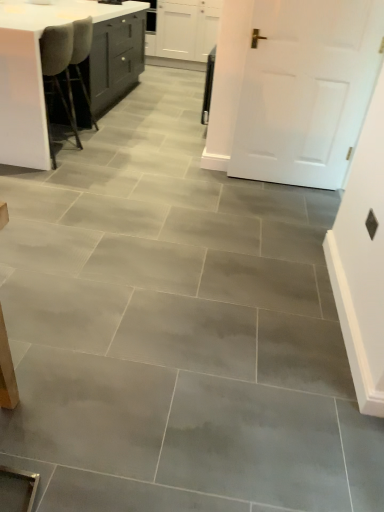
This screenshot has height=512, width=384. Describe the element at coordinates (306, 90) in the screenshot. I see `white matte door at upper right` at that location.

Describe the element at coordinates (184, 29) in the screenshot. I see `white matte cabinet at upper center` at that location.

You are a GUI agent. You are given a task and a screenshot of the screen. Output one action in this format:
    pyautogui.click(x=<x>, y=<y>)
    Task: Click on the white matte door at upper right
    This screenshot has width=384, height=512.
    Given the screenshot: What is the action you would take?
    pyautogui.click(x=306, y=90)

Which of these two, white matte cabinet at upper center or white matte door at upper right, stands taller?

Standing taller between the two is white matte door at upper right.

From the image's perspective, between white matte cabinet at upper center and white matte door at upper right, which one is located above?

white matte cabinet at upper center.

Visually, is white matte cabinet at upper center positioned to the left or to the right of white matte door at upper right?

From the image, it's evident that white matte cabinet at upper center is to the left of white matte door at upper right.

Which object is more forward, white matte cabinet at upper center or white matte door at upper right?

white matte door at upper right.

From the picture: Is white matte cabinet at upper center next to white glossy table at upper left and touching it?

white matte cabinet at upper center and white glossy table at upper left are not in contact.

Is white matte cabinet at upper center completely or partially outside of white glossy table at upper left?

Yes, white matte cabinet at upper center is outside of white glossy table at upper left.

Based on the photo, is the depth of white matte cabinet at upper center greater than that of white glossy table at upper left?

Yes, the depth of white matte cabinet at upper center is greater than that of white glossy table at upper left.

Considering the points (148, 49) and (31, 30), which point is behind, point (148, 49) or point (31, 30)?

Positioned behind is point (148, 49).

From the image's perspective, relative to white matte door at upper right, is white glossy table at upper left above or below?

Clearly, from the image's perspective, white glossy table at upper left is above white matte door at upper right.

Which object is positioned more to the left, white glossy table at upper left or white matte door at upper right?

white glossy table at upper left.

What's the angular difference between white glossy table at upper left and white matte door at upper right's facing directions?

white glossy table at upper left and white matte door at upper right are facing 1.97 degrees away from each other.

Is white matte door at upper right bigger or smaller than white glossy table at upper left?

Considering their sizes, white matte door at upper right takes up less space than white glossy table at upper left.

Is white matte door at upper right wider than white glossy table at upper left?

Incorrect, the width of white matte door at upper right does not surpass that of white glossy table at upper left.

The height and width of the screenshot is (512, 384). I want to click on table located behind the white matte door at upper right, so click(x=34, y=72).

Considering the positions of point (313, 162) and point (84, 7), is point (313, 162) closer or farther from the camera than point (84, 7)?

Point (313, 162) is farther from the camera than point (84, 7).

From the image's perspective, would you say white matte door at upper right is shown under white matte cabinet at upper center?

Correct, white matte door at upper right appears lower than white matte cabinet at upper center in the image.

How far apart are white matte door at upper right and white matte cabinet at upper center?

white matte door at upper right is 3.65 meters away from white matte cabinet at upper center.

Could white matte cabinet at upper center be considered to be inside white matte door at upper right?

That's incorrect, white matte cabinet at upper center is not inside white matte door at upper right.

Does white matte door at upper right have a larger size compared to white matte cabinet at upper center?

Incorrect, white matte door at upper right is not larger than white matte cabinet at upper center.

I want to click on cabinetry located above the white glossy table at upper left (from a real-world perspective), so click(184, 29).

Looking at this image, from the image's perspective, is white glossy table at upper left below white matte cabinet at upper center?

Yes.

Which object is wider, white glossy table at upper left or white matte cabinet at upper center?

Wider between the two is white glossy table at upper left.

Considering the sizes of objects white glossy table at upper left and white matte cabinet at upper center in the image provided, who is shorter, white glossy table at upper left or white matte cabinet at upper center?

Standing shorter between the two is white glossy table at upper left.

At what (x,y) coordinates should I click in order to perform the action: click on cabinetry located above the white matte door at upper right (from the image's perspective). Please return your answer as a coordinate pair (x, y). Looking at the image, I should click on (184, 29).

The height and width of the screenshot is (512, 384). I want to click on table below the white matte cabinet at upper center (from the image's perspective), so click(34, 72).

Which object lies nearer to the anchor point white matte cabinet at upper center, white glossy table at upper left or white matte door at upper right?

Among the two, white glossy table at upper left is located nearer to white matte cabinet at upper center.

Estimate the real-world distances between objects in this image. Which object is closer to white matte door at upper right, white matte cabinet at upper center or white glossy table at upper left?

The object closer to white matte door at upper right is white glossy table at upper left.

Considering their positions, is white matte cabinet at upper center positioned further to white glossy table at upper left than white matte door at upper right?

Among the two, white matte cabinet at upper center is located further to white glossy table at upper left.

Based on their spatial positions, is white matte door at upper right or white glossy table at upper left closer to white matte cabinet at upper center?

Among the two, white glossy table at upper left is located nearer to white matte cabinet at upper center.

Considering their positions, is white glossy table at upper left positioned further to white matte door at upper right than white matte cabinet at upper center?

Based on the image, white matte cabinet at upper center appears to be further to white matte door at upper right.

From the image, which object appears to be farther from white glossy table at upper left, white matte door at upper right or white matte cabinet at upper center?

The object further to white glossy table at upper left is white matte cabinet at upper center.

This screenshot has width=384, height=512. Identify the location of table located between white matte door at upper right and white matte cabinet at upper center in the depth direction. (34, 72).